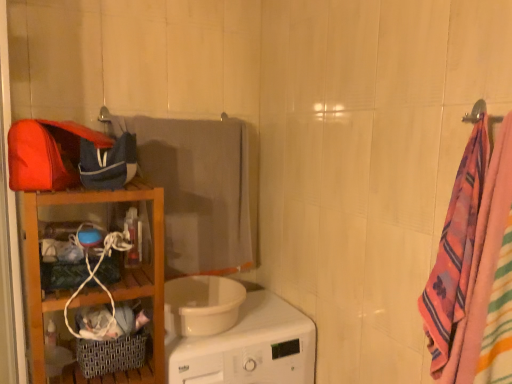
Question: Considering their positions, is gray fabric towel at center, the second beach towel from the front, located in front of or behind wooden shelf at left?

Choices:
 (A) front
 (B) behind

Answer: (B)

Question: Is gray fabric towel at center, acting as the first beach towel starting from the back, to the left or to the right of wooden shelf at left in the image?

Choices:
 (A) left
 (B) right

Answer: (B)

Question: Which of these objects is positioned farthest from the multicolored woven towel at right, which is the first beach towel from right to left?

Choices:
 (A) white glossy washing machine at center
 (B) wooden shelf at left
 (C) gray fabric towel at center, which is the 1th beach towel in left-to-right order

Answer: (C)

Question: Which of these objects is positioned closest to the white glossy washing machine at center?

Choices:
 (A) wooden shelf at left
 (B) multicolored woven towel at right, the 1th beach towel from the front
 (C) gray fabric towel at center, the second beach towel from the right

Answer: (A)